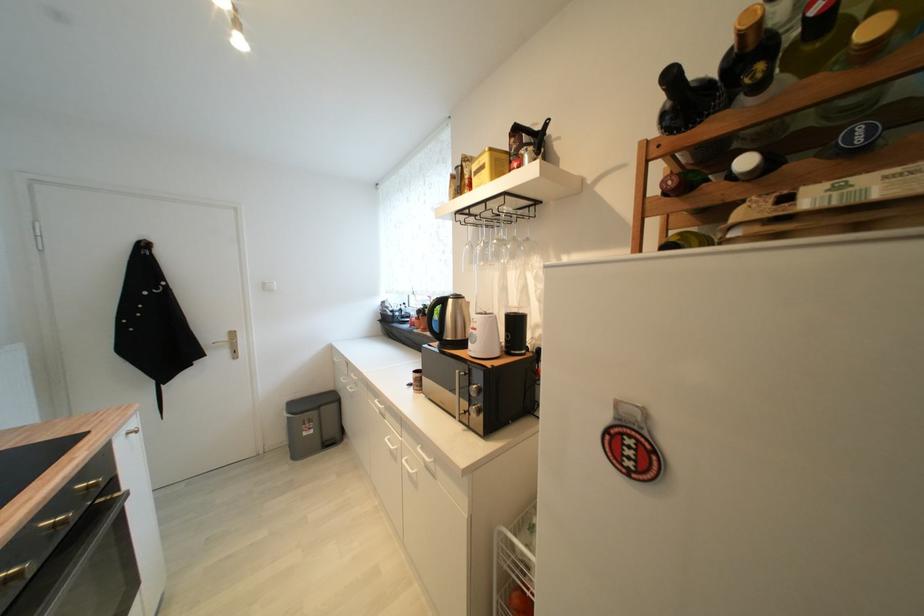
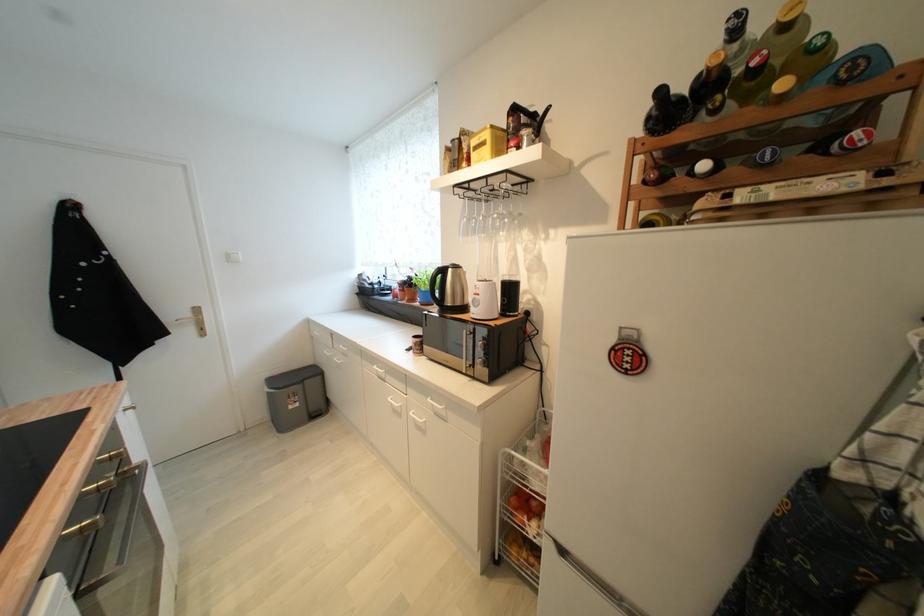
Locate, in the second image, the point that corresponds to the point at 382,403 in the first image.

(380, 369)